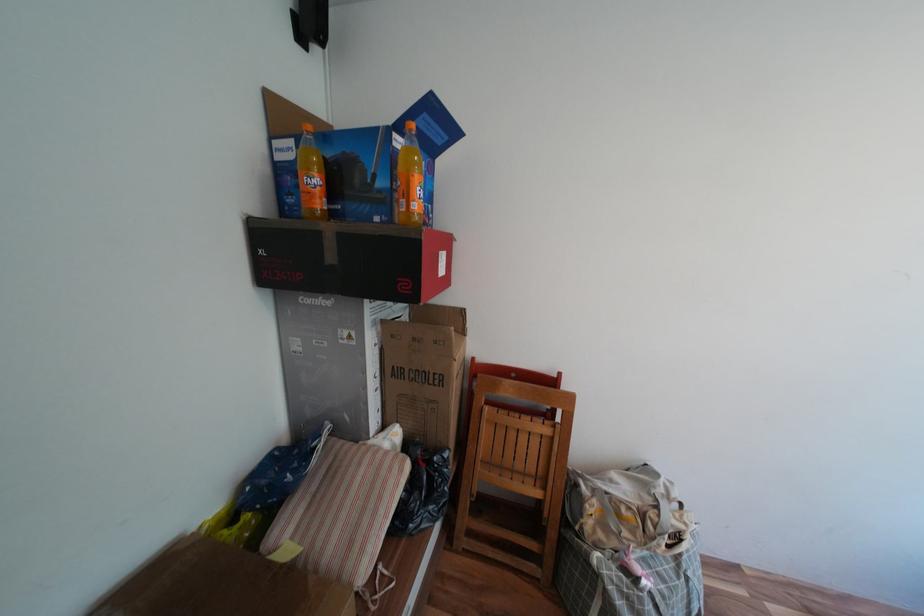
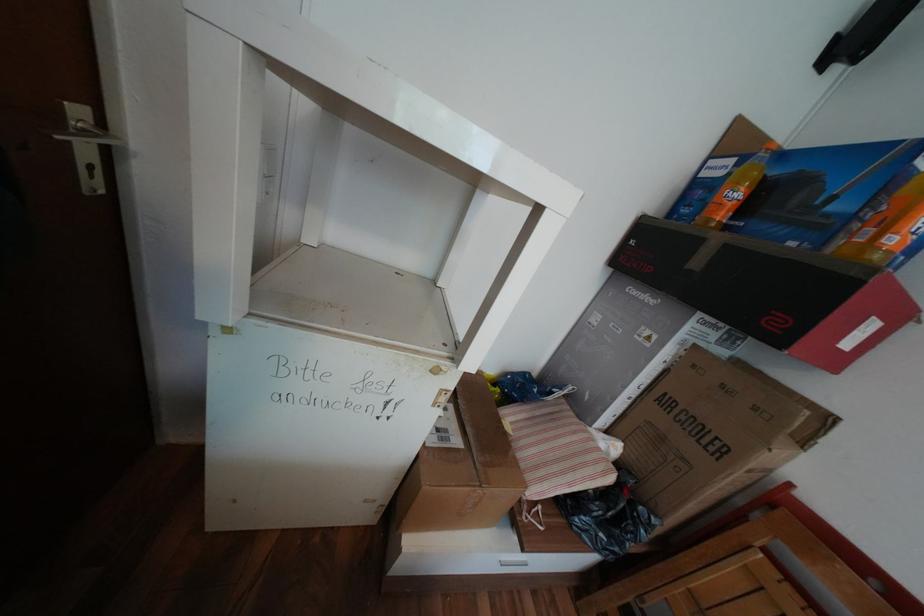
Question: How did the camera likely rotate?

Choices:
 (A) Left
 (B) Right
 (C) Up
 (D) Down

Answer: (A)